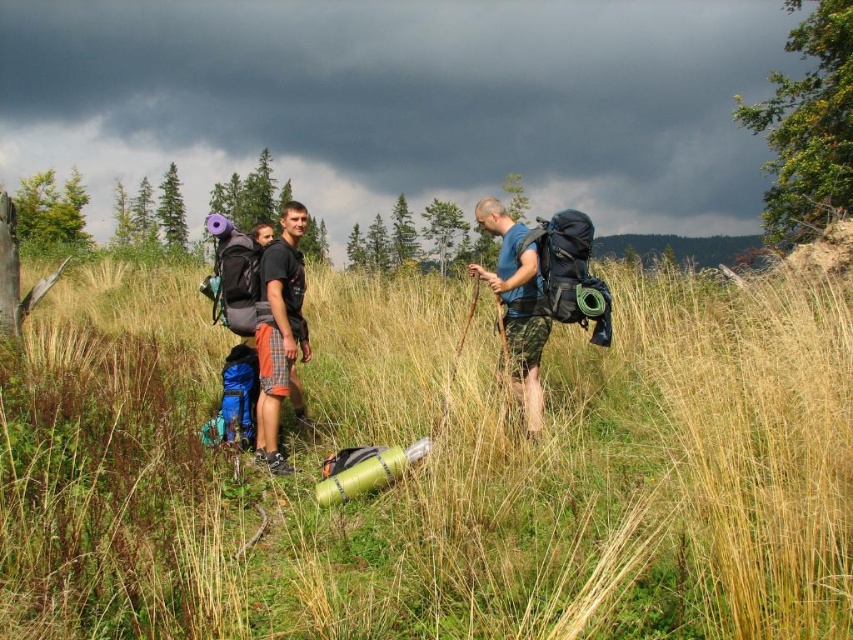
You are one of the hikers in the image and want to step onto the blue fabric backpack at center. Can you step directly onto it from where you are standing on the green grassy at center?

The green grassy at center is closer to the viewer than the blue fabric backpack at center, so you would need to move forward to reach it. Since they are at different distances, you cannot step directly onto the blue fabric backpack at center from your current position on the green grassy at center without moving closer.

You are a hiker planning to set up a tent in the green grassy area at center. The tent requires a flat area that is at least as tall as the blue fabric backpack at center. Based on the scene, will the green grassy at center provide enough height clearance for the tent? Please explain your reasoning.

The green grassy at center is taller than the blue fabric backpack at center. Since the grass is taller than the backpack, it likely provides sufficient height clearance for the tent, which requires an area at least as tall as the backpack. However, the uneven terrain mentioned in the scene might still pose a challenge for setting up the tent.